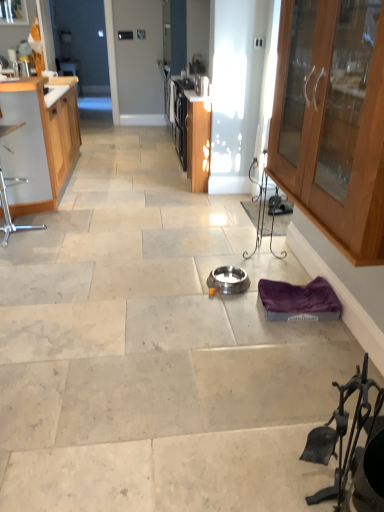
The width and height of the screenshot is (384, 512). I want to click on free area in between black wrought iron fireplace tools at lower right, acting as the second chair starting from the back, and satin silver bowl at center, positioned as the first appliance in bottom-to-top order, so [x=262, y=359].